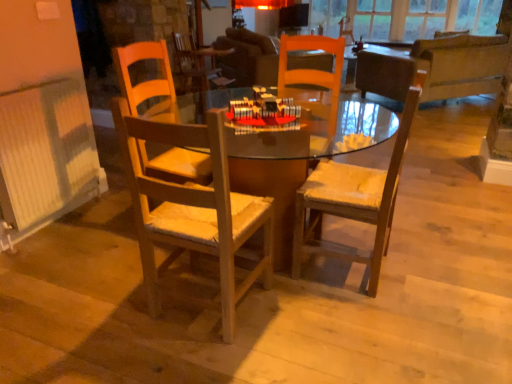
Question: Is dark brown leather couch at upper right wider or thinner than wooden chair with cushion at center, which is the first chair from right to left?

Choices:
 (A) thin
 (B) wide

Answer: (B)

Question: From a real-world perspective, is dark brown leather couch at upper right above or below wooden chair with cushion at center, which is the first chair from right to left?

Choices:
 (A) below
 (B) above

Answer: (A)

Question: Which is farther from the white ribbed radiator at left?

Choices:
 (A) transparent glass window at upper center
 (B) dark brown leather couch at upper right
 (C) wooden chair with cushion at center, which is counted as the second chair, starting from the left
 (D) wooden table at center
 (E) wooden chair at center, which ranks as the second chair in right-to-left order

Answer: (A)

Question: Estimate the real-world distances between objects in this image. Which object is closer to the wooden chair with cushion at center, which is the first chair from right to left?

Choices:
 (A) wooden chair at center, which ranks as the second chair in right-to-left order
 (B) dark brown leather couch at upper right
 (C) transparent glass window at upper center
 (D) wooden table at center
 (E) white ribbed radiator at left

Answer: (D)